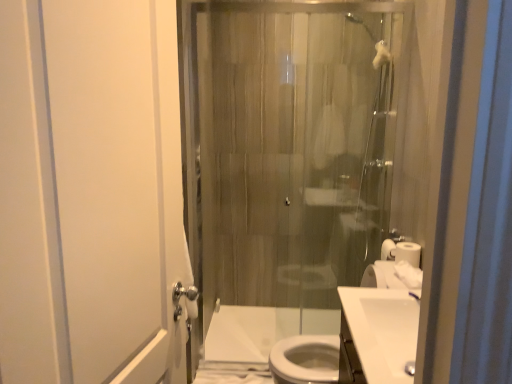
What do you see at coordinates (407, 253) in the screenshot?
I see `white matte toilet paper at right` at bounding box center [407, 253].

The width and height of the screenshot is (512, 384). Find the location of `white matte toilet paper at right`. white matte toilet paper at right is located at coordinates (407, 253).

Locate an element on the screen. The width and height of the screenshot is (512, 384). white matte screen door at left is located at coordinates (115, 179).

Measure the distance between translucent glass shower door at center and camera.

translucent glass shower door at center and camera are 6.57 feet apart.

In order to face white glossy toilet at lower center, should I rotate leftwards or rightwards?

To face it directly, rotate right by 2.789 degrees.

Find the location of a particular element. This screenshot has height=384, width=512. white matte toilet paper at right is located at coordinates (407, 253).

Can we say white glossy toilet at lower center lies outside white glossy sink at center, which appears as the 1th sink when viewed from the back?

Yes.

In the scene shown: Are white glossy toilet at lower center and white glossy sink at center, which appears as the 1th sink when viewed from the back, located far from each other?

white glossy toilet at lower center is positioned a significant distance from white glossy sink at center, which appears as the 1th sink when viewed from the back.

Considering the relative positions of white glossy toilet at lower center and white glossy sink at center, which is the 2th sink from front to back, in the image provided, is white glossy toilet at lower center behind white glossy sink at center, which is the 2th sink from front to back,?

Yes, white glossy toilet at lower center is further from the viewer.

From the image's perspective, is white glossy toilet at lower center positioned above or below white glossy sink at center, which is the 2th sink from front to back?

white glossy toilet at lower center is below white glossy sink at center, which is the 2th sink from front to back.

Which object is wider, translucent glass shower door at center or white matte screen door at left?

With larger width is white matte screen door at left.

Is translucent glass shower door at center oriented towards white matte screen door at left?

Yes, translucent glass shower door at center is facing white matte screen door at left.

From a real-world perspective, relative to white matte screen door at left, is translucent glass shower door at center vertically above or below?

From a real-world perspective, translucent glass shower door at center is physically below white matte screen door at left.

From the image's perspective, would you say translucent glass shower door at center is shown under white matte screen door at left?

No.

Is white glossy sink at center, which is the 2th sink from front to back, placed right next to white glossy sink at lower right, the first sink positioned from the front?

Yes, the surface of white glossy sink at center, which is the 2th sink from front to back, is in contact with white glossy sink at lower right, the first sink positioned from the front.

From the image's perspective, does white glossy sink at center, which appears as the 1th sink when viewed from the back, appear lower than white glossy sink at lower right, which is the second sink from back to front?

Indeed, from the image's perspective, white glossy sink at center, which appears as the 1th sink when viewed from the back, is shown beneath white glossy sink at lower right, which is the second sink from back to front.

Is point (406, 367) closer to camera compared to point (352, 306)?

Yes, it is.

In the image, there is a white glossy sink at center, which appears as the 1th sink when viewed from the back. Identify the location of sink above it (from the image's perspective). (377, 335).

Where is `the 1st sink below the white matte toilet paper at right (from a real-world perspective)`? The width and height of the screenshot is (512, 384). the 1st sink below the white matte toilet paper at right (from a real-world perspective) is located at coordinates (377, 335).

Is white matte toilet paper at right behind white glossy sink at lower right, which is the second sink from back to front?

Yes, it is.

Considering the relative positions of white matte toilet paper at right and white glossy sink at lower right, which is the second sink from back to front, in the image provided, is white matte toilet paper at right to the left of white glossy sink at lower right, which is the second sink from back to front, from the viewer's perspective?

No, white matte toilet paper at right is not to the left of white glossy sink at lower right, which is the second sink from back to front.

Which of these two, white matte toilet paper at right or white glossy sink at lower right, the first sink positioned from the front, stands taller?

white glossy sink at lower right, the first sink positioned from the front.

Is white glossy sink at center, which appears as the 1th sink when viewed from the back, facing away from white matte toilet paper at right?

No.

What's the angular difference between white glossy sink at center, which appears as the 1th sink when viewed from the back, and white matte toilet paper at right's facing directions?

The facing directions of white glossy sink at center, which appears as the 1th sink when viewed from the back, and white matte toilet paper at right are 0.455 degrees apart.

Considering the positions of objects white glossy sink at center, which appears as the 1th sink when viewed from the back, and white matte toilet paper at right in the image provided, who is in front, white glossy sink at center, which appears as the 1th sink when viewed from the back, or white matte toilet paper at right?

white glossy sink at center, which appears as the 1th sink when viewed from the back, is more forward.

From the picture: From the image's perspective, which one is positioned lower, white glossy sink at center, which appears as the 1th sink when viewed from the back, or white matte toilet paper at right?

white glossy sink at center, which appears as the 1th sink when viewed from the back.

Can you confirm if translucent glass shower door at center is wider than white glossy sink at lower right, which is the second sink from back to front?

No.

From the translucent glass shower door at center, count 2nd sinks forward and point to it. Please provide its 2D coordinates.

[(377, 335)]

Which object is closer to the camera taking this photo, translucent glass shower door at center or white glossy sink at lower right, the first sink positioned from the front?

white glossy sink at lower right, the first sink positioned from the front.

How different are the orientations of translucent glass shower door at center and white glossy sink at lower right, which is the second sink from back to front, in degrees?

translucent glass shower door at center and white glossy sink at lower right, which is the second sink from back to front, are facing 93 degrees away from each other.

Is white glossy sink at lower right, the first sink positioned from the front, bigger or smaller than translucent glass shower door at center?

Clearly, white glossy sink at lower right, the first sink positioned from the front, is smaller in size than translucent glass shower door at center.

Considering the relative sizes of white glossy sink at lower right, which is the second sink from back to front, and translucent glass shower door at center in the image provided, is white glossy sink at lower right, which is the second sink from back to front, shorter than translucent glass shower door at center?

Yes, white glossy sink at lower right, which is the second sink from back to front, is shorter than translucent glass shower door at center.

How distant is white glossy sink at lower right, the first sink positioned from the front, from translucent glass shower door at center?

white glossy sink at lower right, the first sink positioned from the front, is 3.87 feet away from translucent glass shower door at center.

Consider the image. Can translucent glass shower door at center be found inside white glossy sink at lower right, which is the second sink from back to front?

That's incorrect, translucent glass shower door at center is not inside white glossy sink at lower right, which is the second sink from back to front.

Find the location of `the 1st sink counting from the right side of the white glossy toilet at lower center`. the 1st sink counting from the right side of the white glossy toilet at lower center is located at coordinates (375, 337).

The height and width of the screenshot is (384, 512). I want to click on shower door that appears behind the white matte screen door at left, so click(x=288, y=164).

Looking at the image, which one is located further to white matte toilet paper at right, white glossy sink at lower right, which is the second sink from back to front, or white matte screen door at left?

white matte screen door at left lies further to white matte toilet paper at right than the other object.

Which object lies further to the anchor point white matte screen door at left, translucent glass shower door at center or white glossy toilet at lower center?

white glossy toilet at lower center is further to white matte screen door at left.

In the scene shown: When comparing their distances from white matte toilet paper at right, does white glossy sink at center, which is the 2th sink from front to back, or white matte screen door at left seem closer?

white glossy sink at center, which is the 2th sink from front to back, lies closer to white matte toilet paper at right than the other object.

When comparing their distances from white matte toilet paper at right, does translucent glass shower door at center or white glossy toilet at lower center seem further?

white glossy toilet at lower center lies further to white matte toilet paper at right than the other object.

Which object lies nearer to the anchor point white glossy sink at center, which appears as the 1th sink when viewed from the back, white matte screen door at left or translucent glass shower door at center?

white matte screen door at left is closer to white glossy sink at center, which appears as the 1th sink when viewed from the back.

Which object lies further to the anchor point translucent glass shower door at center, white matte toilet paper at right or white glossy sink at lower right, the first sink positioned from the front?

white matte toilet paper at right is further to translucent glass shower door at center.

Looking at the image, which one is located further to translucent glass shower door at center, white glossy toilet at lower center or white matte toilet paper at right?

white matte toilet paper at right lies further to translucent glass shower door at center than the other object.

Estimate the real-world distances between objects in this image. Which object is closer to white glossy sink at center, which appears as the 1th sink when viewed from the back, white matte screen door at left or white glossy toilet at lower center?

Among the two, white matte screen door at left is located nearer to white glossy sink at center, which appears as the 1th sink when viewed from the back.

Locate an element on the screen. This screenshot has height=384, width=512. toilet paper between translucent glass shower door at center and white glossy sink at center, which appears as the 1th sink when viewed from the back, from top to bottom is located at coordinates (407, 253).

This screenshot has width=512, height=384. Identify the location of sink positioned between white glossy sink at lower right, the first sink positioned from the front, and white matte toilet paper at right from near to far. (375, 337).

Find the location of `sink located between white matte screen door at left and white glossy sink at center, which is the 2th sink from front to back, in the depth direction`. sink located between white matte screen door at left and white glossy sink at center, which is the 2th sink from front to back, in the depth direction is located at coordinates (377, 335).

Find the location of a particular element. toilet paper between white glossy sink at lower right, which is the second sink from back to front, and translucent glass shower door at center from front to back is located at coordinates (407, 253).